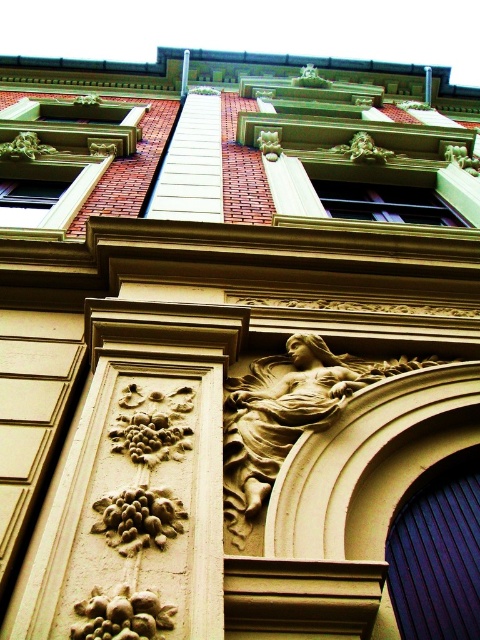
Between carved stone column at center and golden stone relief at center, which one has more height?

Standing taller between the two is carved stone column at center.

What do you see at coordinates (136, 483) in the screenshot? The image size is (480, 640). I see `carved stone column at center` at bounding box center [136, 483].

Which is behind, point (187, 353) or point (236, 417)?

The point (187, 353) is more distant.

You are a GUI agent. You are given a task and a screenshot of the screen. Output one action in this format:
    pyautogui.click(x=<x>, y=<y>)
    Task: Click on the carved stone column at center
    Image resolution: width=480 pixels, height=640 pixels.
    Given the screenshot: What is the action you would take?
    pyautogui.click(x=136, y=483)